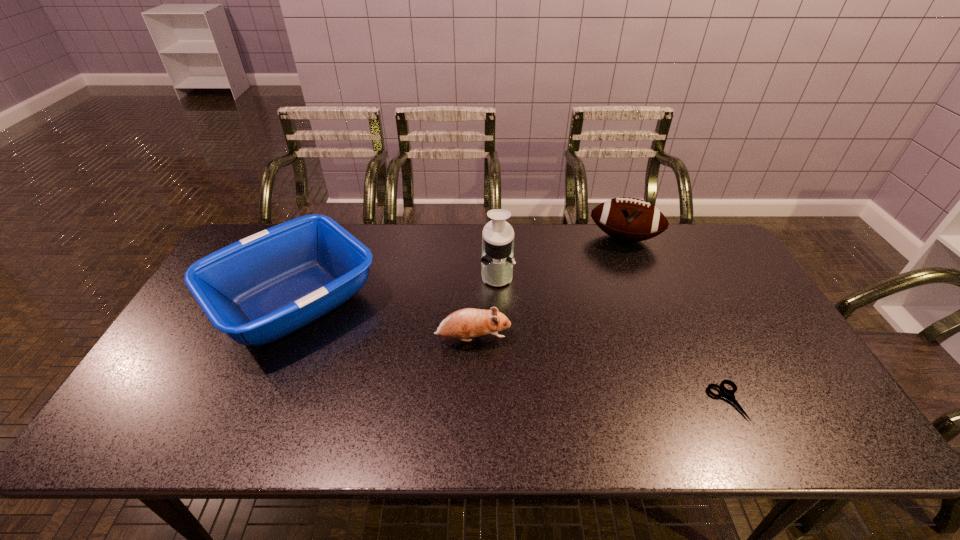
Identify the location of vacant area situated 0.110m on the right of the shears. The width and height of the screenshot is (960, 540). (789, 401).

You are a GUI agent. You are given a task and a screenshot of the screen. Output one action in this format:
    pyautogui.click(x=<x>, y=<y>)
    Task: Click on the juicer positioned at the far edge
    
    Given the screenshot: What is the action you would take?
    pyautogui.click(x=497, y=260)

Where is `football (American) located at the far edge`? The height and width of the screenshot is (540, 960). football (American) located at the far edge is located at coordinates (628, 219).

At what (x,y) coordinates should I click in order to perform the action: click on tray that is at the far edge. Please return your answer as a coordinate pair (x, y). The image size is (960, 540). Looking at the image, I should click on (259, 289).

At what (x,y) coordinates should I click in order to perform the action: click on object that is at the near edge. Please return your answer as a coordinate pair (x, y). The height and width of the screenshot is (540, 960). Looking at the image, I should click on (729, 394).

Locate an element on the screen. This screenshot has height=540, width=960. object located at the left edge is located at coordinates (259, 289).

In order to click on object at the far left corner in this screenshot , I will do `click(259, 289)`.

Find the location of `free space at the far edge`. free space at the far edge is located at coordinates (585, 232).

In the image, there is a desktop. Where is `vacant region at the near edge`? This screenshot has width=960, height=540. vacant region at the near edge is located at coordinates (689, 423).

Identify the location of vacant space at the right edge of the desktop. (757, 296).